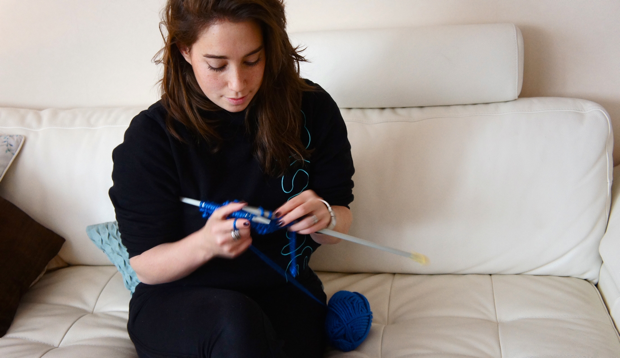
Locate an element on the screen. This screenshot has height=358, width=620. white couch backrest cushion is located at coordinates (435, 182).